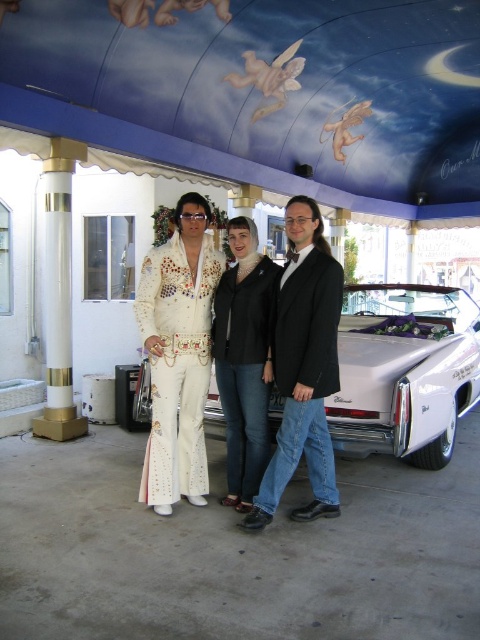
Question: Which object is positioned closest to the white sequined suit at center?

Choices:
 (A) black matte jacket at center
 (B) white glossy car at center
 (C) shiny black suit at center

Answer: (C)

Question: Can you confirm if black matte jacket at center is bigger than white glossy column at left?

Choices:
 (A) no
 (B) yes

Answer: (A)

Question: Among these points, which one is nearest to the camera?

Choices:
 (A) (253, 342)
 (B) (437, 285)
 (C) (254, 509)

Answer: (C)

Question: Can you confirm if white sequined suit at center is positioned above shiny black suit at center?

Choices:
 (A) no
 (B) yes

Answer: (B)

Question: Is white glossy car at center below white glossy column at left?

Choices:
 (A) yes
 (B) no

Answer: (A)

Question: Which point appears closest to the camera in this image?

Choices:
 (A) (315, 486)
 (B) (147, 442)
 (C) (218, 301)

Answer: (A)